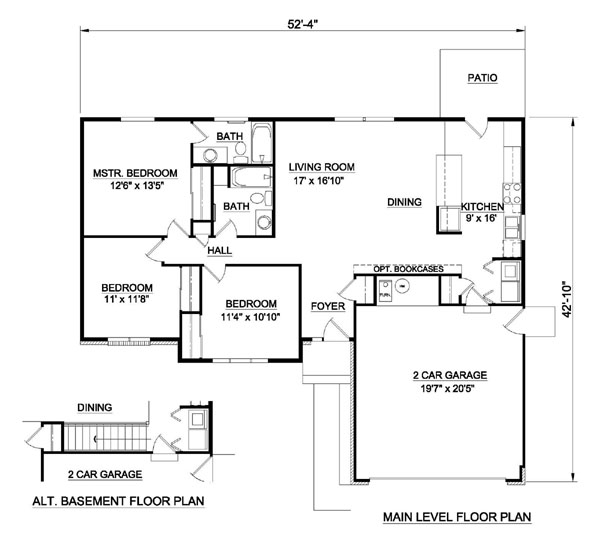
Find the location of a particular element. The image size is (600, 544). master bath is located at coordinates (227, 129).